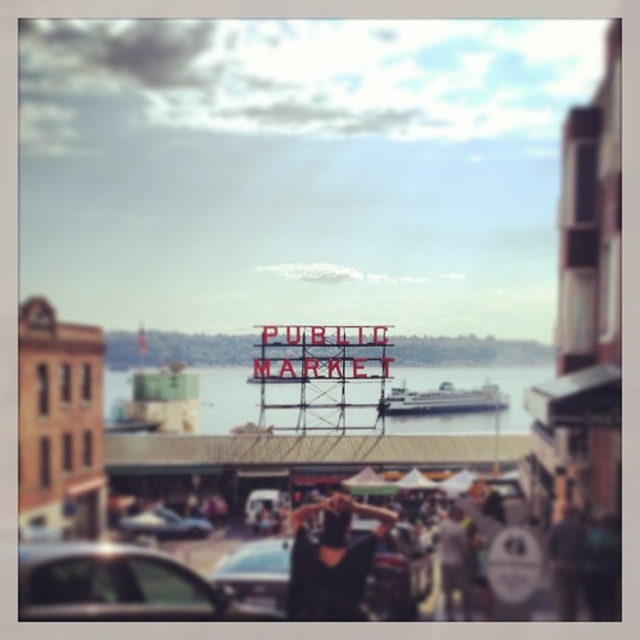
Who is taller, red painted metal sign at center or white glossy ferry at center?

With more height is red painted metal sign at center.

Is red painted metal sign at center in front of white glossy ferry at center?

Yes, it is.

Is point (296, 324) positioned behind point (413, 401)?

No.

In order to click on red painted metal sign at center in this screenshot , I will do `click(323, 376)`.

Who is lower down, metallic water at center or white glossy ferry at center?

Positioned lower is white glossy ferry at center.

Does metallic water at center have a lesser width compared to white glossy ferry at center?

No.

The height and width of the screenshot is (640, 640). What do you see at coordinates (480, 385) in the screenshot? I see `metallic water at center` at bounding box center [480, 385].

Find the location of a particular element. metallic water at center is located at coordinates (480, 385).

Is white glossy ferry at center below metallic silver car at lower center?

No.

Is white glossy ferry at center above metallic silver car at lower center?

Correct, white glossy ferry at center is located above metallic silver car at lower center.

Is point (464, 401) closer to viewer compared to point (156, 536)?

That is False.

Find the location of a particular element. This screenshot has height=640, width=640. white glossy ferry at center is located at coordinates (444, 400).